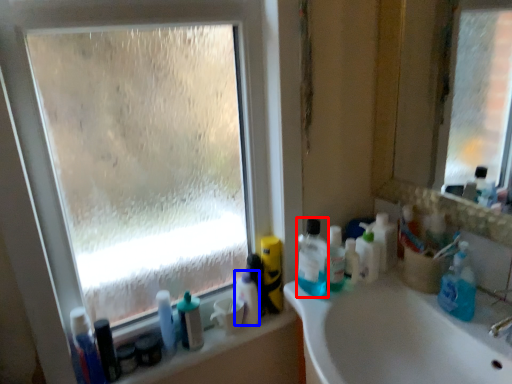
Question: Which object appears farthest to the camera in this image, cleaning product (highlighted by a red box) or toiletry (highlighted by a blue box)?

Choices:
 (A) cleaning product
 (B) toiletry

Answer: (B)